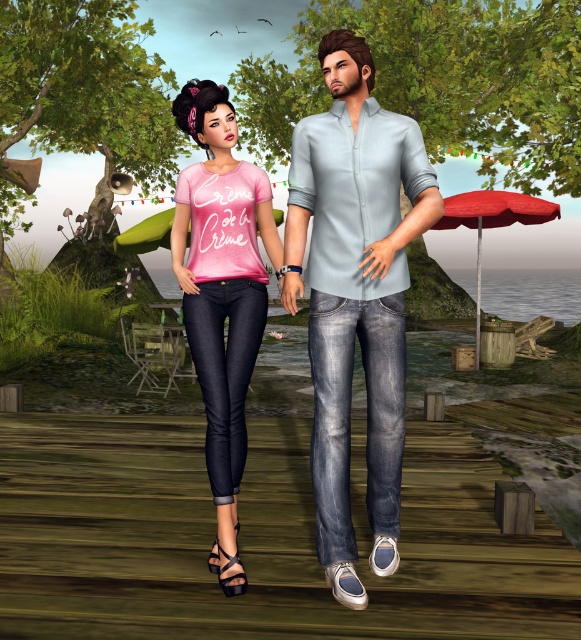
Is red fabric umbrella at right wider than pink fabric umbrella at center?

Correct, the width of red fabric umbrella at right exceeds that of pink fabric umbrella at center.

Does red fabric umbrella at right appear on the left side of pink fabric umbrella at center?

No, red fabric umbrella at right is not to the left of pink fabric umbrella at center.

Who is more distant from viewer, (456, 211) or (150, 225)?

Positioned behind is point (456, 211).

The height and width of the screenshot is (640, 581). Find the location of `red fabric umbrella at right`. red fabric umbrella at right is located at coordinates (492, 221).

Is pink matte t-shirt at center bigger than red fabric umbrella at right?

Indeed, pink matte t-shirt at center has a larger size compared to red fabric umbrella at right.

Where is `pink matte t-shirt at center`? The height and width of the screenshot is (640, 581). pink matte t-shirt at center is located at coordinates (221, 294).

Does light blue denim jeans at center have a lesser height compared to pink fabric umbrella at center?

In fact, light blue denim jeans at center may be taller than pink fabric umbrella at center.

Image resolution: width=581 pixels, height=640 pixels. Describe the element at coordinates (356, 296) in the screenshot. I see `light blue denim jeans at center` at that location.

This screenshot has height=640, width=581. What are the coordinates of `light blue denim jeans at center` in the screenshot? It's located at (356, 296).